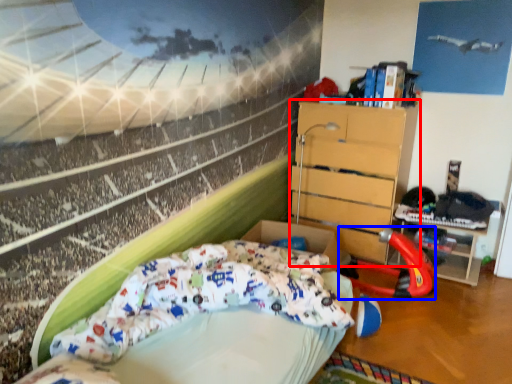
Question: Which of the following is the farthest to the observer, chest of drawers (highlighted by a red box) or sport equipment (highlighted by a blue box)?

Choices:
 (A) chest of drawers
 (B) sport equipment

Answer: (A)